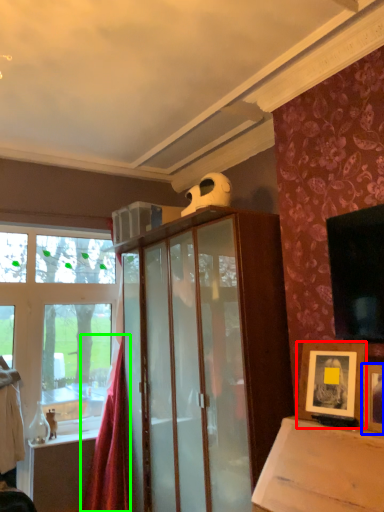
Question: Which object is the farthest from picture frame (highlighted by a red box)? Choose among these: picture frame (highlighted by a blue box) or curtain (highlighted by a green box).

Choices:
 (A) picture frame
 (B) curtain

Answer: (B)